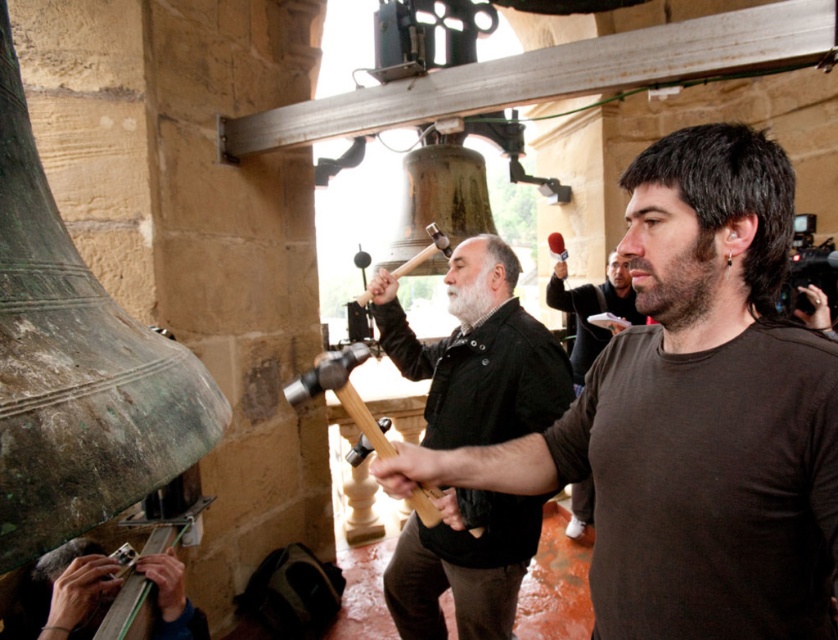
Looking at this image, between dark brown leather jacket at center and metallic silver watch at lower left, which one is positioned lower?

metallic silver watch at lower left

Does point (427, 442) come farther from viewer compared to point (91, 540)?

That is True.

Does point (416, 596) come farther from viewer compared to point (66, 595)?

Yes, point (416, 596) is behind point (66, 595).

Locate an element on the screen. dark brown leather jacket at center is located at coordinates (479, 358).

Is dark brown leather jacket at center below white matte beard at center?

Indeed, dark brown leather jacket at center is positioned under white matte beard at center.

Consider the image. Does dark brown leather jacket at center have a greater width compared to white matte beard at center?

Indeed, dark brown leather jacket at center has a greater width compared to white matte beard at center.

Measure the distance between dark brown leather jacket at center and camera.

The distance of dark brown leather jacket at center from camera is 2.28 meters.

This screenshot has height=640, width=838. Find the location of `dark brown leather jacket at center`. dark brown leather jacket at center is located at coordinates (479, 358).

Is brown cotton shirt at center bigger than white matte beard at center?

Correct, brown cotton shirt at center is larger in size than white matte beard at center.

Is point (749, 602) positioned before point (484, 292)?

Yes, point (749, 602) is in front of point (484, 292).

I want to click on brown cotton shirt at center, so click(694, 422).